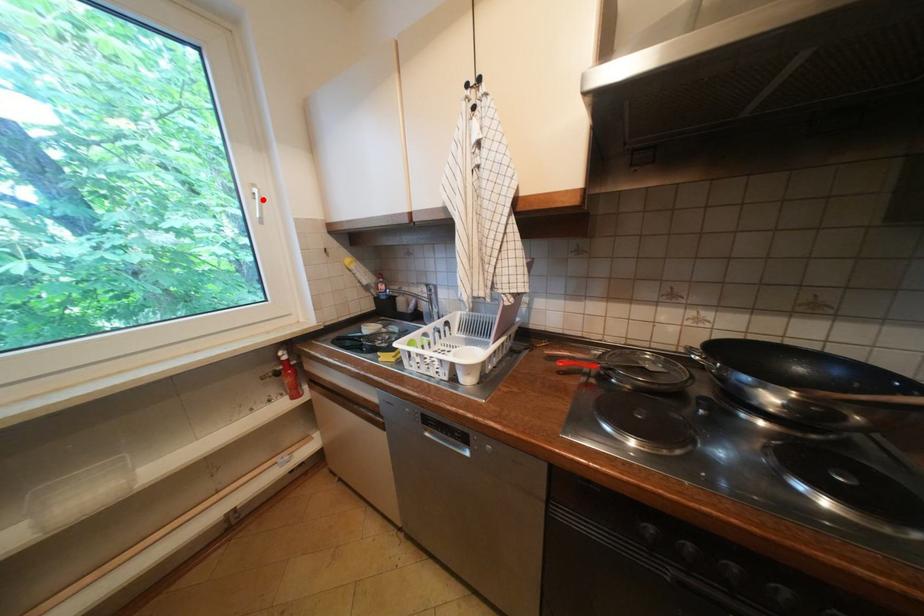
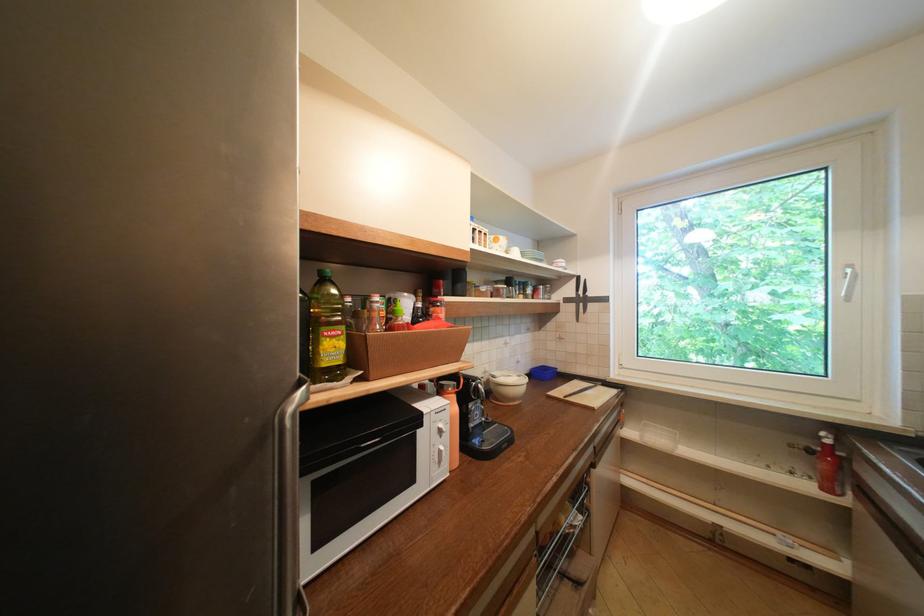
Locate, in the second image, the point that corresponds to the highlighted location in the first image.

(854, 280)